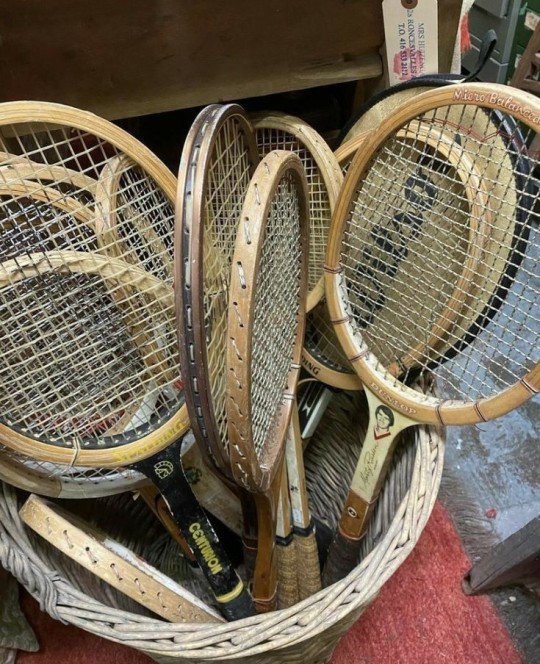
I want to click on floor or pavement, so click(x=512, y=475).